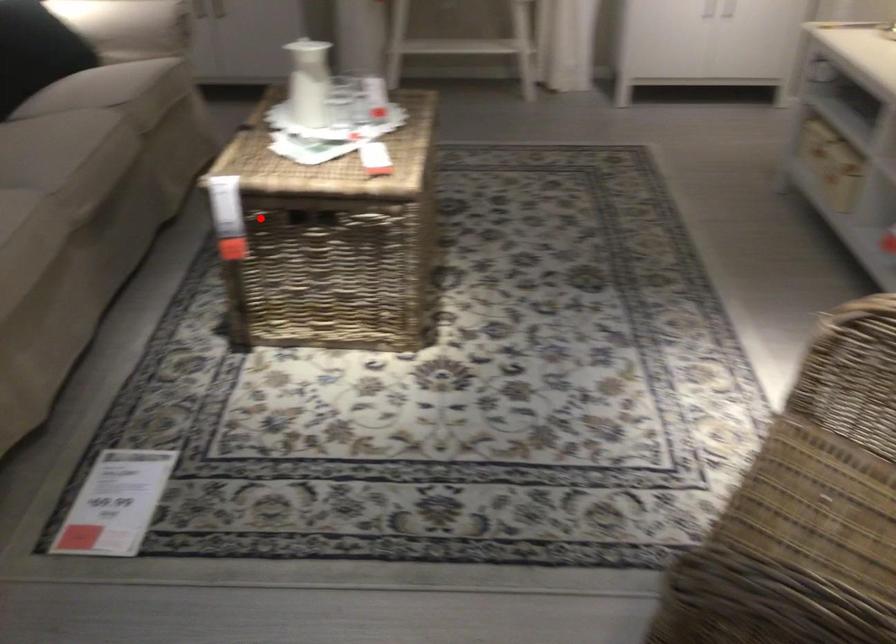
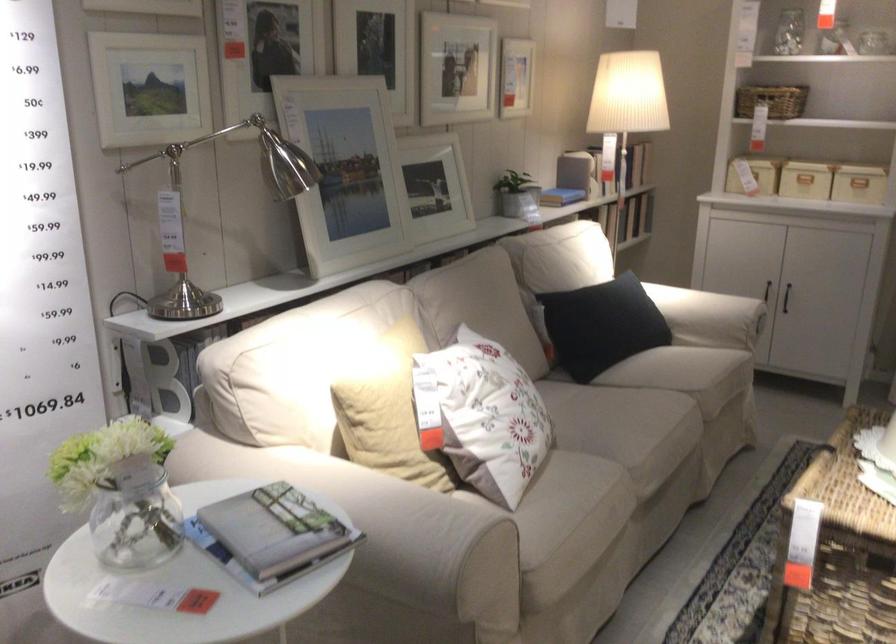
Locate, in the second image, the point that corresponds to the highlighted location in the first image.

(839, 552)